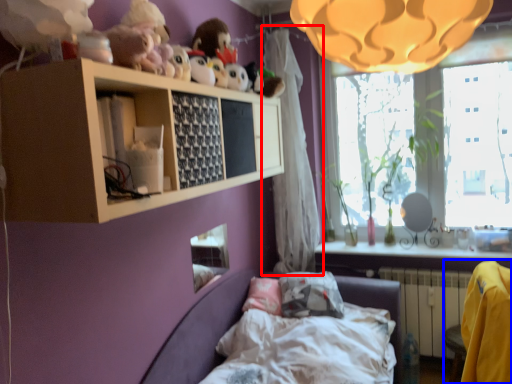
Question: Which object appears closest to the camera in this image, curtain (highlighted by a red box) or armchair (highlighted by a blue box)?

Choices:
 (A) curtain
 (B) armchair

Answer: (B)